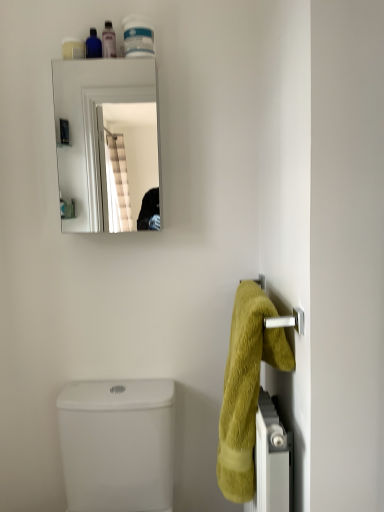
Question: Does white glossy container at upper center, placed as the 4th toiletry when sorted from left to right, have a lesser height compared to soft yellow towel at right?

Choices:
 (A) no
 (B) yes

Answer: (B)

Question: Is white glossy container at upper center, which is the first toiletry from right to left, positioned beyond the bounds of soft yellow towel at right?

Choices:
 (A) no
 (B) yes

Answer: (B)

Question: Does white glossy container at upper center, which is the first toiletry from right to left, come in front of soft yellow towel at right?

Choices:
 (A) no
 (B) yes

Answer: (A)

Question: Can you confirm if white glossy container at upper center, which is the first toiletry from right to left, is positioned to the left of soft yellow towel at right?

Choices:
 (A) no
 (B) yes

Answer: (B)

Question: Is white glossy container at upper center, which is the first toiletry from right to left, aimed at soft yellow towel at right?

Choices:
 (A) no
 (B) yes

Answer: (A)

Question: Is soft yellow towel at right bigger or smaller than matte blue bottle at upper left, the third toiletry viewed from the right?

Choices:
 (A) small
 (B) big

Answer: (B)

Question: Considering the positions of soft yellow towel at right and matte blue bottle at upper left, marked as the 2th toiletry in a left-to-right arrangement, in the image, is soft yellow towel at right wider or thinner than matte blue bottle at upper left, marked as the 2th toiletry in a left-to-right arrangement,?

Choices:
 (A) thin
 (B) wide

Answer: (B)

Question: From the image's perspective, relative to matte blue bottle at upper left, marked as the 2th toiletry in a left-to-right arrangement, is soft yellow towel at right above or below?

Choices:
 (A) above
 (B) below

Answer: (B)

Question: Is soft yellow towel at right inside or outside of matte blue bottle at upper left, the third toiletry viewed from the right?

Choices:
 (A) outside
 (B) inside

Answer: (A)

Question: Does point (251, 345) appear closer or farther from the camera than point (112, 38)?

Choices:
 (A) closer
 (B) farther

Answer: (A)

Question: Is soft yellow towel at right spatially inside translucent plastic bottle at upper center, the 2th toiletry from the right, or outside of it?

Choices:
 (A) inside
 (B) outside

Answer: (B)

Question: From their relative heights in the image, would you say soft yellow towel at right is taller or shorter than translucent plastic bottle at upper center, the 3th toiletry viewed from the left?

Choices:
 (A) tall
 (B) short

Answer: (A)

Question: From a real-world perspective, is soft yellow towel at right above or below translucent plastic bottle at upper center, the 3th toiletry viewed from the left?

Choices:
 (A) above
 (B) below

Answer: (B)

Question: Is translucent plastic bottle at upper center, the 3th toiletry viewed from the left, spatially inside clear glass mirror at upper center, or outside of it?

Choices:
 (A) inside
 (B) outside

Answer: (B)

Question: Considering the positions of translucent plastic bottle at upper center, the 2th toiletry from the right, and clear glass mirror at upper center in the image, is translucent plastic bottle at upper center, the 2th toiletry from the right, taller or shorter than clear glass mirror at upper center?

Choices:
 (A) tall
 (B) short

Answer: (B)